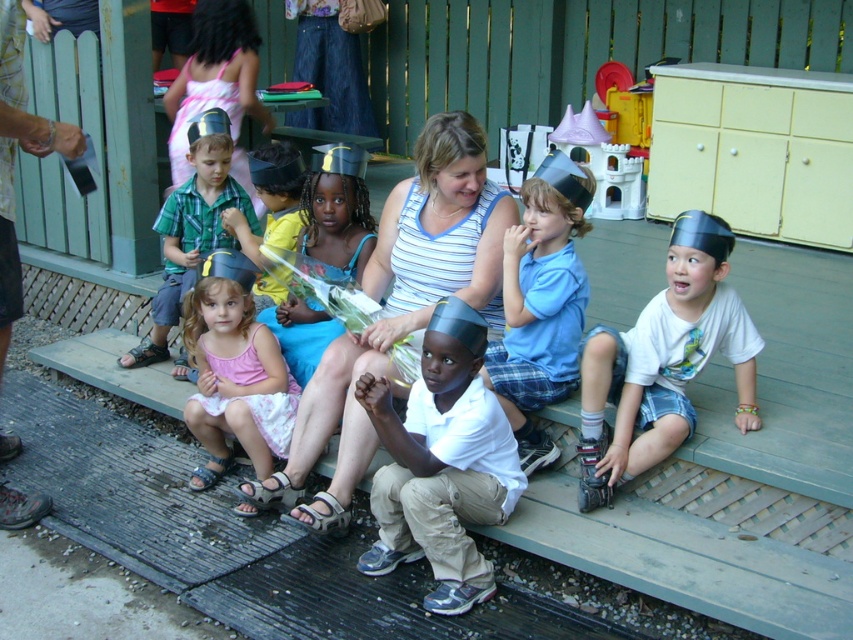
Question: Is pink satin dress at lower left smaller than yellow fabric shirt at center?

Choices:
 (A) no
 (B) yes

Answer: (A)

Question: Which object is positioned farthest from the yellow fabric shirt at center?

Choices:
 (A) pink satin dress at lower left
 (B) white matte shirt at center
 (C) pink fabric dress at center

Answer: (B)

Question: Can you confirm if pink satin dress at lower left is positioned to the left of pink fabric dress at center?

Choices:
 (A) yes
 (B) no

Answer: (B)

Question: Which point appears closest to the camera in this image?

Choices:
 (A) (223, 192)
 (B) (271, 211)

Answer: (B)

Question: Does blue cotton shirt at center have a larger size compared to blue fabric dress at center?

Choices:
 (A) no
 (B) yes

Answer: (A)

Question: Among these points, which one is farthest from the camera?

Choices:
 (A) (193, 300)
 (B) (254, 236)
 (C) (181, 221)

Answer: (C)